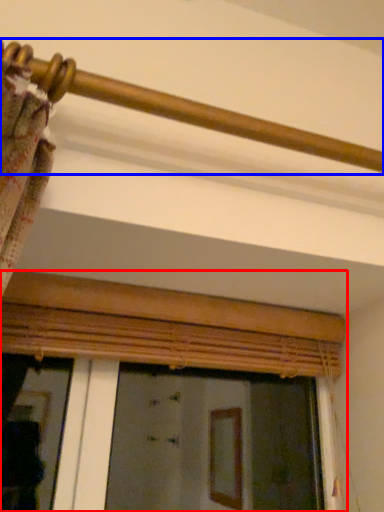
Question: Among these objects, which one is nearest to the camera, window (highlighted by a red box) or rail (highlighted by a blue box)?

Choices:
 (A) window
 (B) rail

Answer: (B)